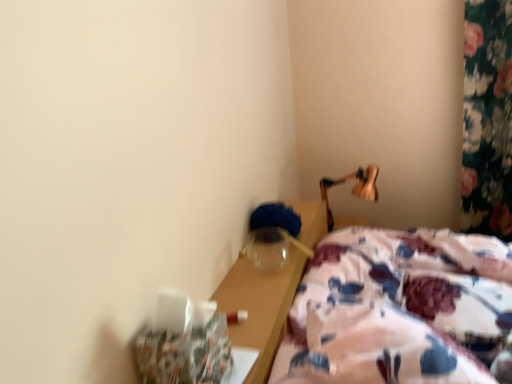
Question: Considering the relative sizes of floral fabric bed at lower right and wooden lamp at upper right in the image provided, is floral fabric bed at lower right taller than wooden lamp at upper right?

Choices:
 (A) no
 (B) yes

Answer: (B)

Question: Is floral fabric bed at lower right to the right of wooden lamp at upper right from the viewer's perspective?

Choices:
 (A) no
 (B) yes

Answer: (A)

Question: From a real-world perspective, is floral fabric bed at lower right on top of wooden lamp at upper right?

Choices:
 (A) yes
 (B) no

Answer: (A)

Question: From a real-world perspective, is floral fabric bed at lower right below wooden lamp at upper right?

Choices:
 (A) no
 (B) yes

Answer: (A)

Question: Does floral fabric bed at lower right have a greater width compared to wooden lamp at upper right?

Choices:
 (A) no
 (B) yes

Answer: (B)

Question: Is floral fabric bed at lower right positioned with its back to wooden lamp at upper right?

Choices:
 (A) yes
 (B) no

Answer: (B)

Question: Is wooden lamp at upper right positioned with its back to floral fabric bed at lower right?

Choices:
 (A) no
 (B) yes

Answer: (A)

Question: Is wooden lamp at upper right wider than floral fabric bed at lower right?

Choices:
 (A) no
 (B) yes

Answer: (A)

Question: Does wooden lamp at upper right have a lesser width compared to floral fabric bed at lower right?

Choices:
 (A) no
 (B) yes

Answer: (B)

Question: Can you confirm if wooden lamp at upper right is bigger than floral fabric bed at lower right?

Choices:
 (A) yes
 (B) no

Answer: (B)

Question: Is there a large distance between wooden lamp at upper right and floral fabric bed at lower right?

Choices:
 (A) yes
 (B) no

Answer: (B)

Question: Does wooden lamp at upper right come in front of floral fabric bed at lower right?

Choices:
 (A) no
 (B) yes

Answer: (A)

Question: Is floral fabric bed at lower right wider or thinner than wooden lamp at upper right?

Choices:
 (A) wide
 (B) thin

Answer: (A)